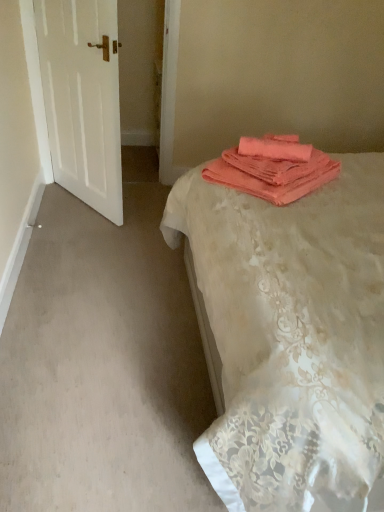
Question: Is the surface of white matte door at left in direct contact with coral fabric bed at center?

Choices:
 (A) yes
 (B) no

Answer: (B)

Question: From a real-world perspective, is white matte door at left over coral fabric bed at center?

Choices:
 (A) no
 (B) yes

Answer: (A)

Question: From the image's perspective, is white matte door at left below coral fabric bed at center?

Choices:
 (A) no
 (B) yes

Answer: (A)

Question: Considering the relative sizes of white matte door at left and coral fabric bed at center in the image provided, is white matte door at left shorter than coral fabric bed at center?

Choices:
 (A) no
 (B) yes

Answer: (B)

Question: Considering the relative sizes of white matte door at left and coral fabric bed at center in the image provided, is white matte door at left thinner than coral fabric bed at center?

Choices:
 (A) no
 (B) yes

Answer: (B)

Question: From the image's perspective, relative to white matte door at left, is coral fabric towels at upper right above or below?

Choices:
 (A) below
 (B) above

Answer: (A)

Question: Relative to white matte door at left, is coral fabric towels at upper right in front or behind?

Choices:
 (A) behind
 (B) front

Answer: (B)

Question: Considering the positions of coral fabric towels at upper right and white matte door at left in the image, is coral fabric towels at upper right bigger or smaller than white matte door at left?

Choices:
 (A) small
 (B) big

Answer: (A)

Question: Is coral fabric towels at upper right inside or outside of white matte door at left?

Choices:
 (A) outside
 (B) inside

Answer: (A)

Question: From the image's perspective, is coral fabric bed at center above or below coral fabric towels at upper right?

Choices:
 (A) above
 (B) below

Answer: (B)

Question: In the image, is coral fabric bed at center positioned in front of or behind coral fabric towels at upper right?

Choices:
 (A) front
 (B) behind

Answer: (A)

Question: From their relative heights in the image, would you say coral fabric bed at center is taller or shorter than coral fabric towels at upper right?

Choices:
 (A) tall
 (B) short

Answer: (A)

Question: In terms of size, does coral fabric bed at center appear bigger or smaller than coral fabric towels at upper right?

Choices:
 (A) big
 (B) small

Answer: (A)

Question: Looking at the image, does coral fabric bed at center seem bigger or smaller compared to white matte door at left?

Choices:
 (A) big
 (B) small

Answer: (A)

Question: Is coral fabric bed at center inside the boundaries of white matte door at left, or outside?

Choices:
 (A) inside
 (B) outside

Answer: (B)